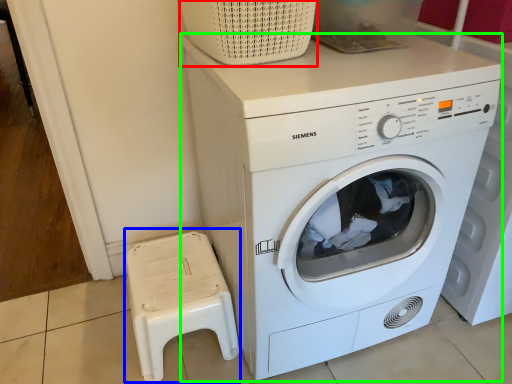
Question: Which is farther away from basket (highlighted by a red box)? music stool (highlighted by a blue box) or washing machine (highlighted by a green box)?

Choices:
 (A) music stool
 (B) washing machine

Answer: (A)